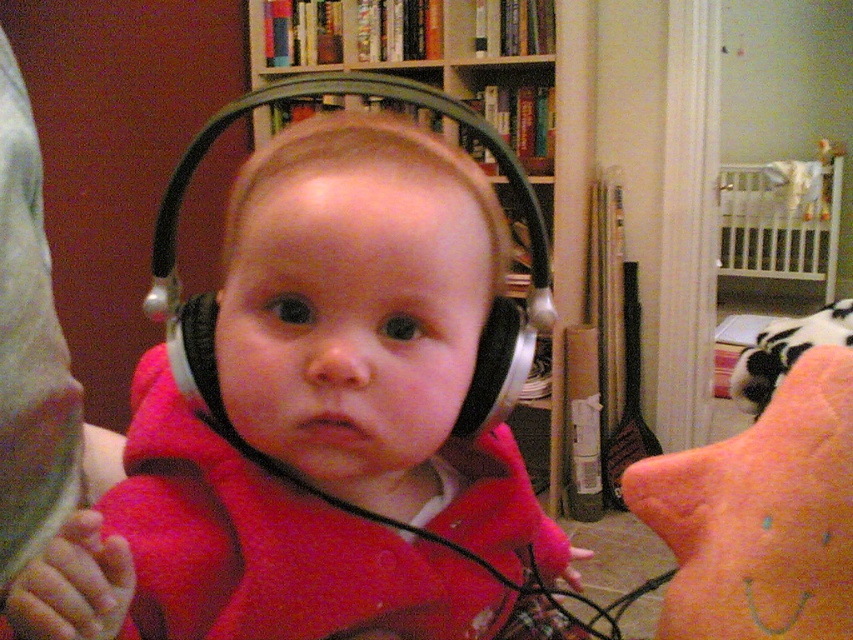
Question: Is matte black headphones at center further to camera compared to wooden bookshelf at upper center?

Choices:
 (A) yes
 (B) no

Answer: (B)

Question: Is matte black headphones at center behind wooden bookshelf at upper center?

Choices:
 (A) no
 (B) yes

Answer: (A)

Question: Is matte black headphones at center closer to camera compared to wooden bookshelf at upper center?

Choices:
 (A) yes
 (B) no

Answer: (A)